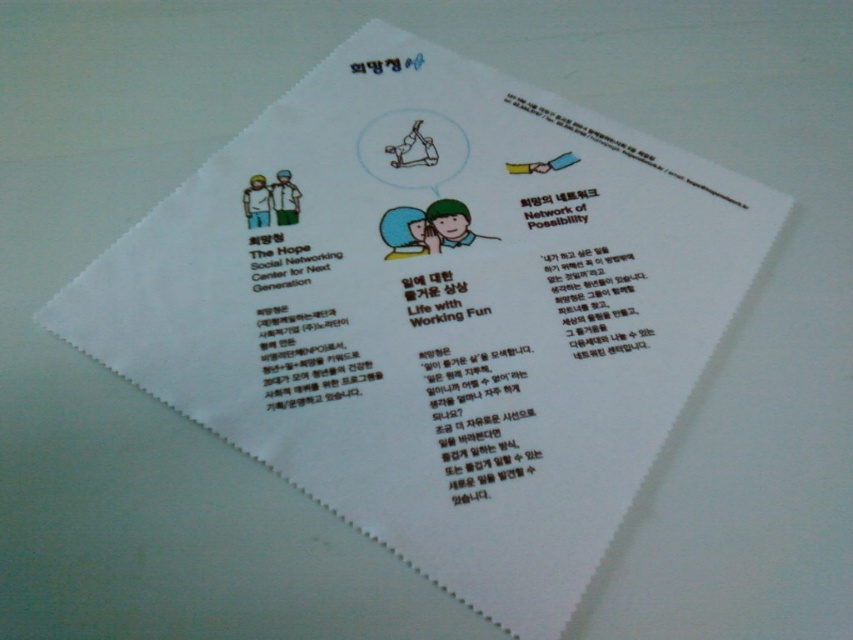
Question: Does black matte paper at center lie behind white paper at upper right?

Choices:
 (A) yes
 (B) no

Answer: (B)

Question: Which object is farther from the camera taking this photo?

Choices:
 (A) black matte paper at center
 (B) black matte text at upper center
 (C) white paper at upper right
 (D) black paper network of possibility at upper center

Answer: (C)

Question: Which point is closer to the camera taking this photo?

Choices:
 (A) (624, 349)
 (B) (366, 371)

Answer: (B)

Question: Is black matte paper at center closer to the viewer compared to white paper at upper right?

Choices:
 (A) yes
 (B) no

Answer: (A)

Question: Which point is closer to the camera taking this photo?

Choices:
 (A) (569, 195)
 (B) (660, 163)
 (C) (630, 266)
 (D) (332, 336)

Answer: (D)

Question: Is black matte text at upper center to the right of white paper at upper right from the viewer's perspective?

Choices:
 (A) yes
 (B) no

Answer: (B)